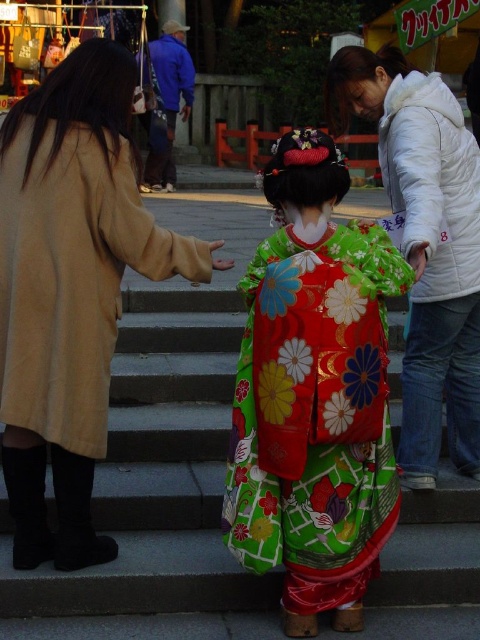
Question: Which of the following is the farthest from the observer?

Choices:
 (A) floral silk kimono at center
 (B) smooth concrete stairs at center

Answer: (B)

Question: Is beige wool coat at left above matte brown hand at center?

Choices:
 (A) yes
 (B) no

Answer: (B)

Question: Is floral silk kimono at center to the left of beige wool coat at left from the viewer's perspective?

Choices:
 (A) no
 (B) yes

Answer: (A)

Question: Considering the relative positions of floral silk kimono at center and beige wool coat at left in the image provided, where is floral silk kimono at center located with respect to beige wool coat at left?

Choices:
 (A) below
 (B) above

Answer: (A)

Question: Which object is farther from the camera taking this photo?

Choices:
 (A) beige wool coat at left
 (B) white puffy jacket at upper right
 (C) smooth concrete stairs at center

Answer: (C)

Question: Among these points, which one is farthest from the camera?

Choices:
 (A) (223, 264)
 (B) (471, 440)
 (C) (167, 260)
 (D) (261, 492)

Answer: (B)